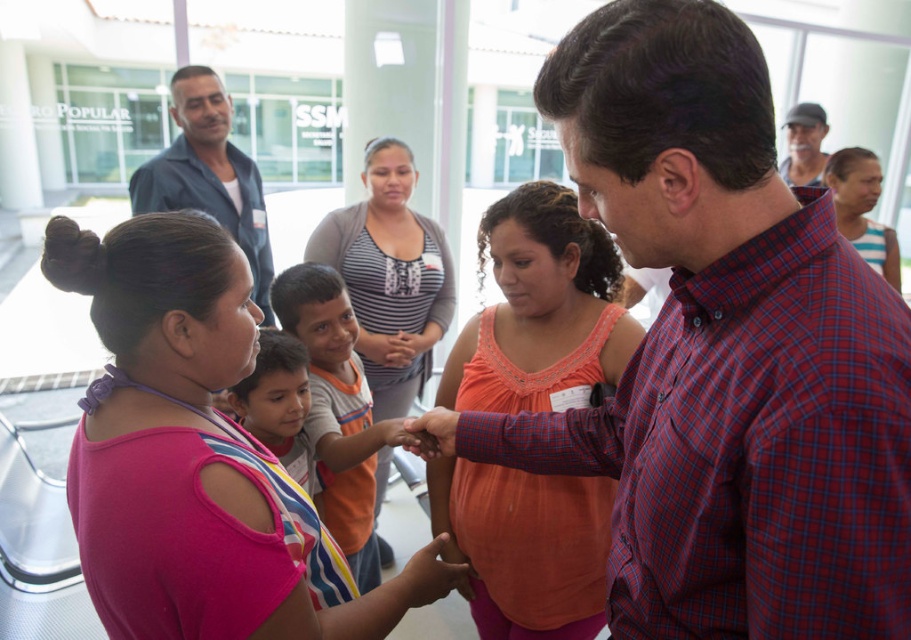
Question: Is orange cotton tank top at center wider than striped fabric shirt at upper right?

Choices:
 (A) no
 (B) yes

Answer: (B)

Question: Is plaid shirt at center wider than matte black cap at upper right?

Choices:
 (A) no
 (B) yes

Answer: (B)

Question: Which of these objects is positioned farthest from the striped knit sweater at center?

Choices:
 (A) striped fabric shirt at upper right
 (B) pink fabric shirt at center

Answer: (A)

Question: Based on their relative distances, which object is nearer to the plaid shirt at center?

Choices:
 (A) dark blue shirt at upper left
 (B) striped knit sweater at center
 (C) striped fabric shirt at upper right
 (D) matte black cap at upper right

Answer: (B)

Question: Which point is closer to the camera taking this photo?

Choices:
 (A) (316, 412)
 (B) (735, 108)
 (C) (202, 102)
 (D) (394, 148)

Answer: (B)

Question: Considering the relative positions of dark blue shirt at upper left and matte black cap at upper right in the image provided, where is dark blue shirt at upper left located with respect to matte black cap at upper right?

Choices:
 (A) below
 (B) above

Answer: (A)